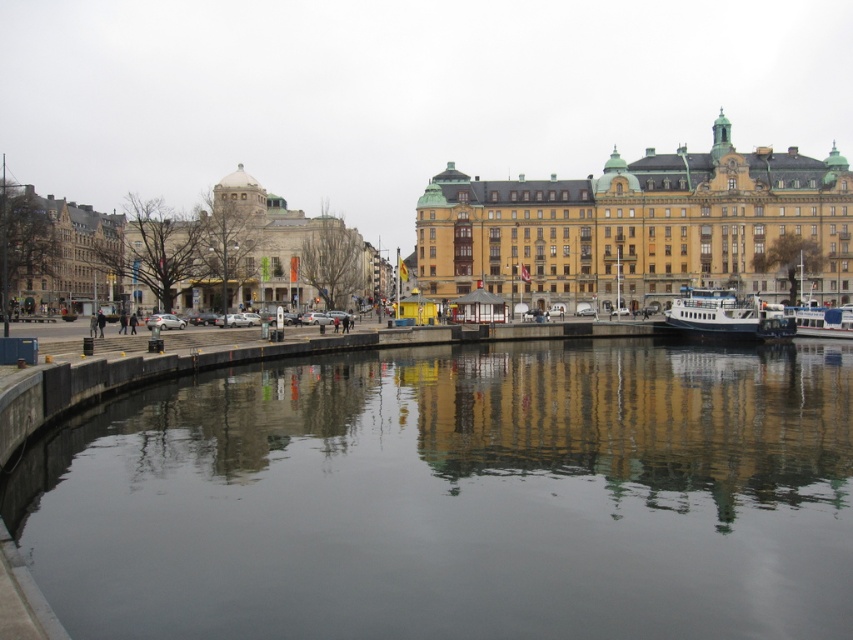
What is the 2D coordinate of the smooth concrete river at center?

The smooth concrete river at center is located at the 2D coordinate point of (456, 497).

You are a photographer planning to capture the smooth concrete river at center and the beige stone building at left in a single shot. Given that your camera can only focus on one object clearly, which object should you prioritize to ensure it fills more of the frame?

The smooth concrete river at center should be prioritized as it is larger in size than the beige stone building at left, meaning it occupies more space in the frame.